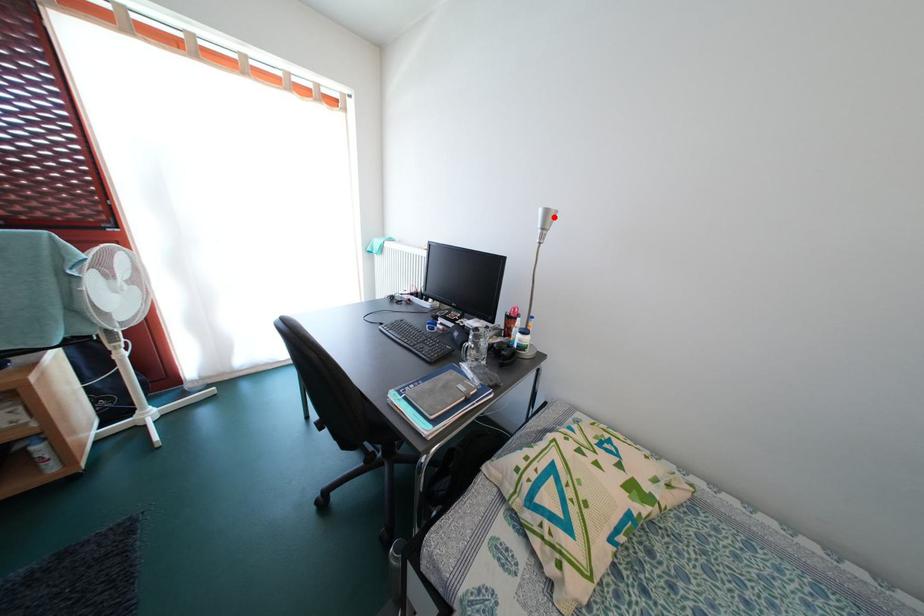
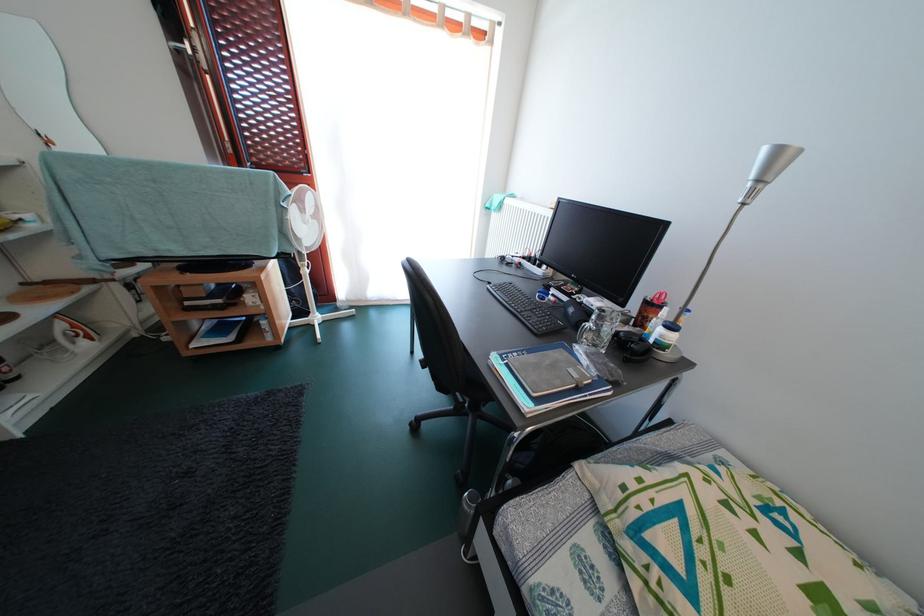
The point at the highlighted location is marked in the first image. Where is the corresponding point in the second image?

(785, 156)